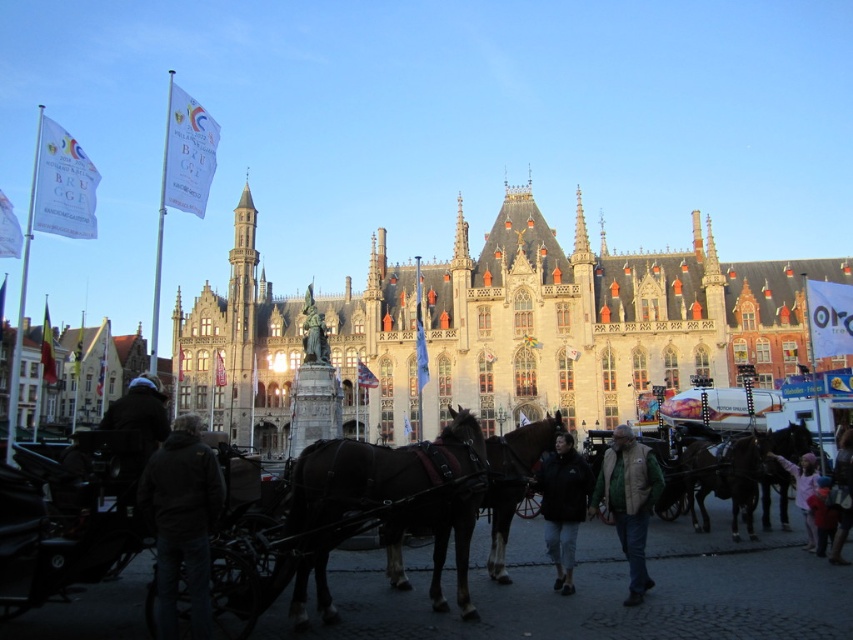
Consider the image. You are a tourist standing in front of the historic building and see the shiny brown horse at center and the brown glossy horse at center. Which horse is closer to you?

Both horses are the same horse. The description mentions they are at the same position, so there is no difference in their distance from you.

You are standing in front of the stone gothic building at center and want to greet someone wearing the dark blue jacket at center. In which direction should you walk to reach them?

You should walk to your right because the stone gothic building at center is to the left of the dark blue jacket at center, meaning the person is on your right side relative to the building.

You are standing in front of the historic building and see two horses. Which horse, the shiny brown horse at center or the brown glossy horse at center, is positioned higher up in the image?

The shiny brown horse at center is positioned higher up in the image than the brown glossy horse at center.